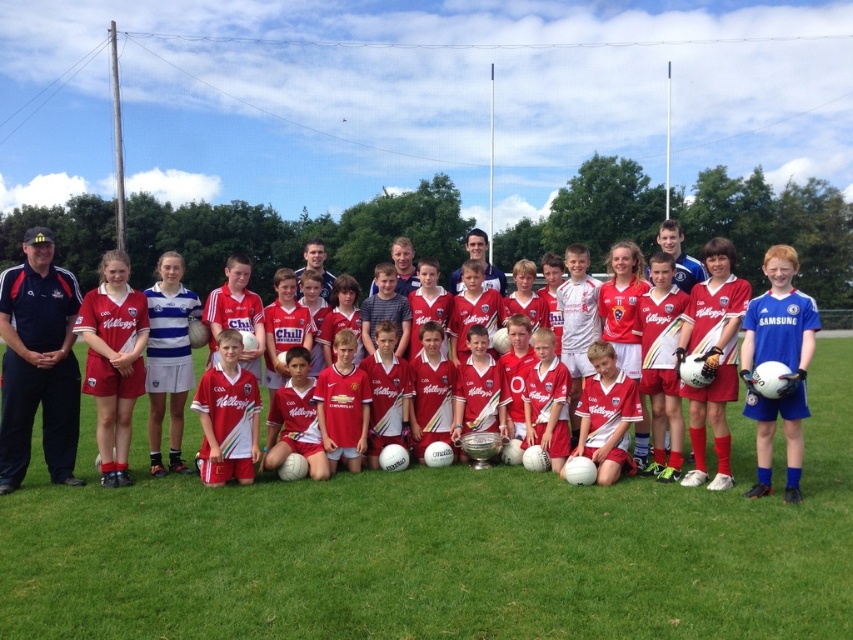
You are a photographer setting up for a team photo. You notice the green grass football field at center and the red matte jersey at center. Which object is taller when viewed from above?

The red matte jersey at center is taller than the green grass football field at center.

You are a photographer trying to capture a closeup of the blue matte football at right and the smooth white jersey at center. Which object should you zoom in on to ensure both fit in the frame without cropping?

The blue matte football at right occupies less space than the smooth white jersey at center, so you should zoom in on the smooth white jersey at center to ensure both fit in the frame without cropping.